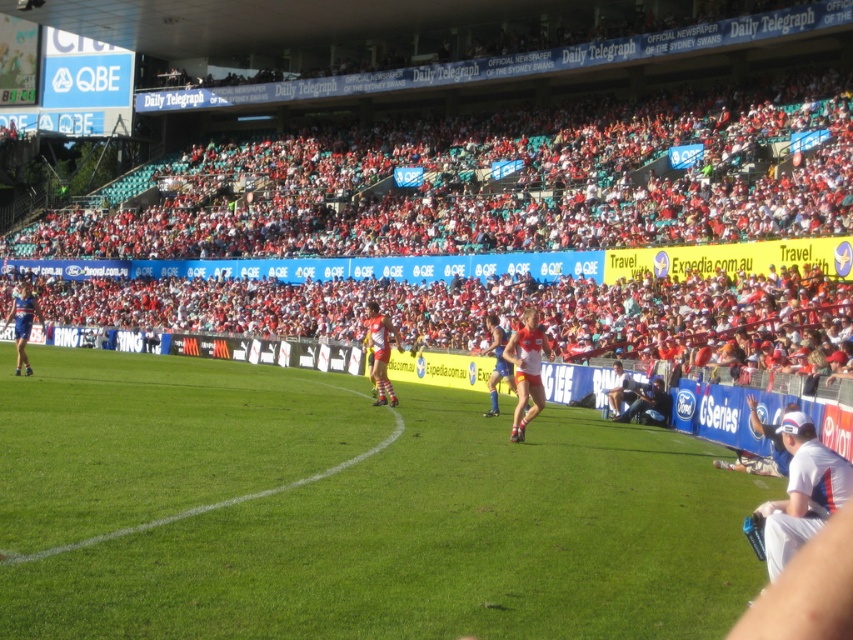
Find the location of a particular element. This screenshot has width=853, height=640. green grass at center is located at coordinates (347, 512).

Is green grass at center behind blue jersey at left?

No.

This screenshot has width=853, height=640. What do you see at coordinates (347, 512) in the screenshot? I see `green grass at center` at bounding box center [347, 512].

Where is `green grass at center`? This screenshot has height=640, width=853. green grass at center is located at coordinates (347, 512).

Based on the photo, is green grass at center smaller than white cotton cap at lower right?

No.

Who is more distant from viewer, (253, 618) or (799, 492)?

Point (799, 492)

You are a GUI agent. You are given a task and a screenshot of the screen. Output one action in this format:
    pyautogui.click(x=<x>, y=<y>)
    Task: Click on the green grass at center
    This screenshot has width=853, height=640.
    Given the screenshot: What is the action you would take?
    pyautogui.click(x=347, y=512)

Who is higher up, orange jersey at center or yellow jersey at center?

orange jersey at center is above.

Is orange jersey at center thinner than yellow jersey at center?

No, orange jersey at center is not thinner than yellow jersey at center.

Does point (389, 394) come in front of point (490, 378)?

Yes, point (389, 394) is in front of point (490, 378).

This screenshot has height=640, width=853. Identify the location of orange jersey at center. (380, 353).